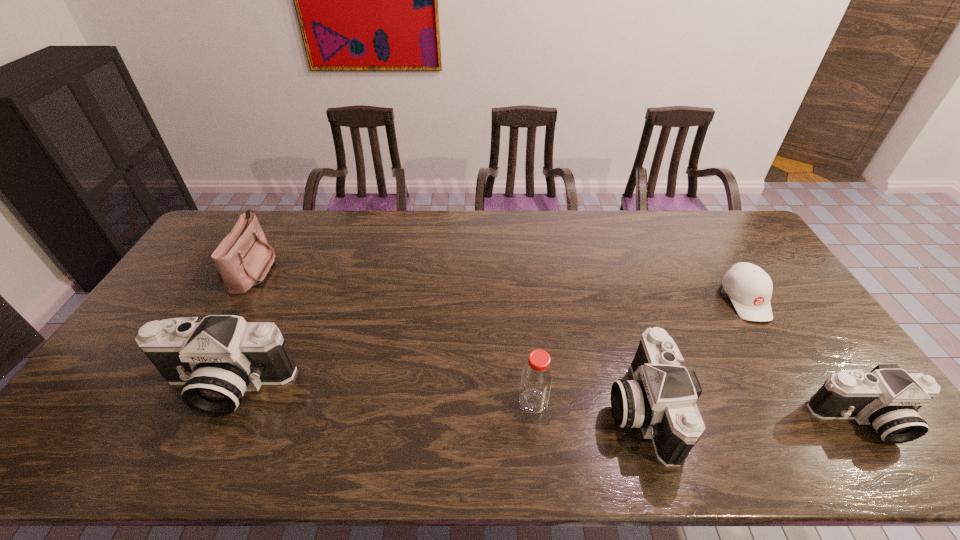
At what (x,y) coordinates should I click in order to perform the action: click on free space between the shortest object and the shoulder bag. Please return your answer as a coordinate pair (x, y). Image resolution: width=960 pixels, height=540 pixels. Looking at the image, I should click on (499, 285).

At what (x,y) coordinates should I click in order to perform the action: click on vacant space that's between the shoulder bag and the rightmost camera. Please return your answer as a coordinate pair (x, y). This screenshot has height=540, width=960. Looking at the image, I should click on (559, 345).

I want to click on free space between the shoulder bag and the second camera from left to right, so click(x=447, y=339).

What are the coordinates of `empty space that is in between the rightmost camera and the baseball cap` in the screenshot? It's located at (804, 360).

Where is `empty space between the shortest object and the leftmost camera`? empty space between the shortest object and the leftmost camera is located at coordinates (485, 343).

Identify which object is located as the nearest to the shoulder bag. Please provide its 2D coordinates. Your answer should be formatted as a tuple, i.e. [(x, y)], where the tuple contains the x and y coordinates of a point satisfying the conditions above.

[(216, 360)]

Select which object appears as the closest to the third object from right to left. Please provide its 2D coordinates. Your answer should be formatted as a tuple, i.e. [(x, y)], where the tuple contains the x and y coordinates of a point satisfying the conditions above.

[(536, 379)]

Select which camera appears as the second closest to the leftmost camera. Please provide its 2D coordinates. Your answer should be formatted as a tuple, i.e. [(x, y)], where the tuple contains the x and y coordinates of a point satisfying the conditions above.

[(888, 398)]

Identify the location of camera that is the second closest to the rightmost camera. (216, 360).

The height and width of the screenshot is (540, 960). In order to click on free space that satisfies the following two spatial constraints: 1. on the front-facing side of the shortest camera; 2. on the right side of the shortest object in this screenshot , I will do pyautogui.click(x=819, y=420).